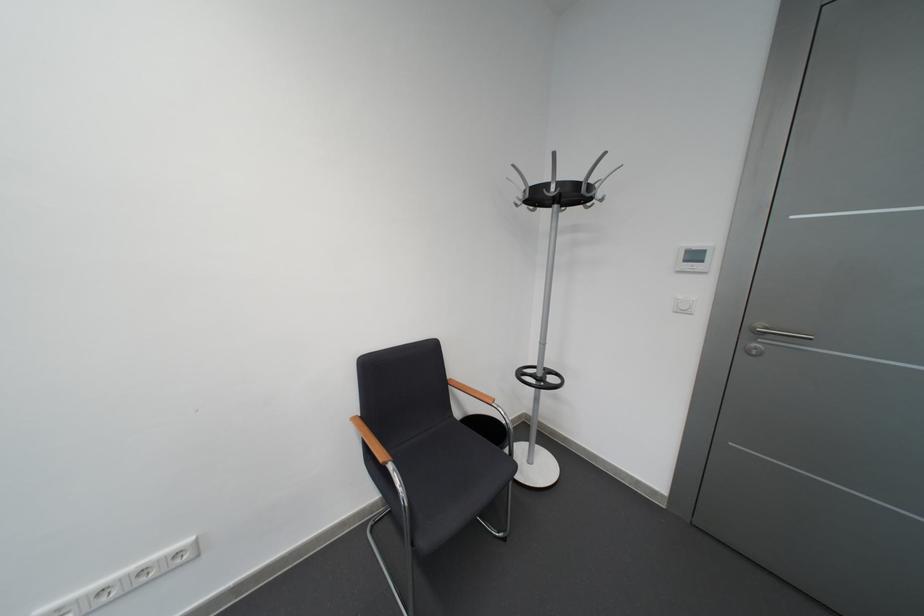
Find where to resting arm the wooden chair armrest. Please return your answer as a coordinate pair (x, y).

(371, 440)